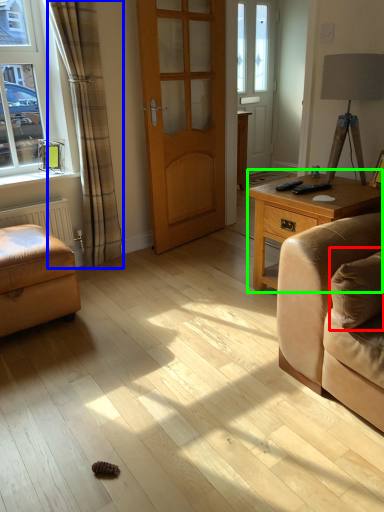
Question: Considering the real-world distances, which object is closest to pillow (highlighted by a red box)? curtain (highlighted by a blue box) or table (highlighted by a green box).

Choices:
 (A) curtain
 (B) table

Answer: (B)